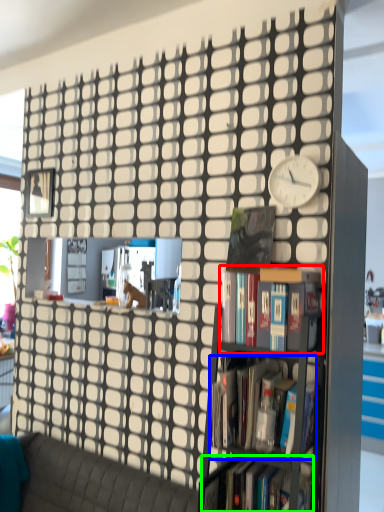
Question: Estimate the real-world distances between objects in this image. Which object is closer to book (highlighted by a red box), book (highlighted by a blue box) or book (highlighted by a green box)?

Choices:
 (A) book
 (B) book

Answer: (A)